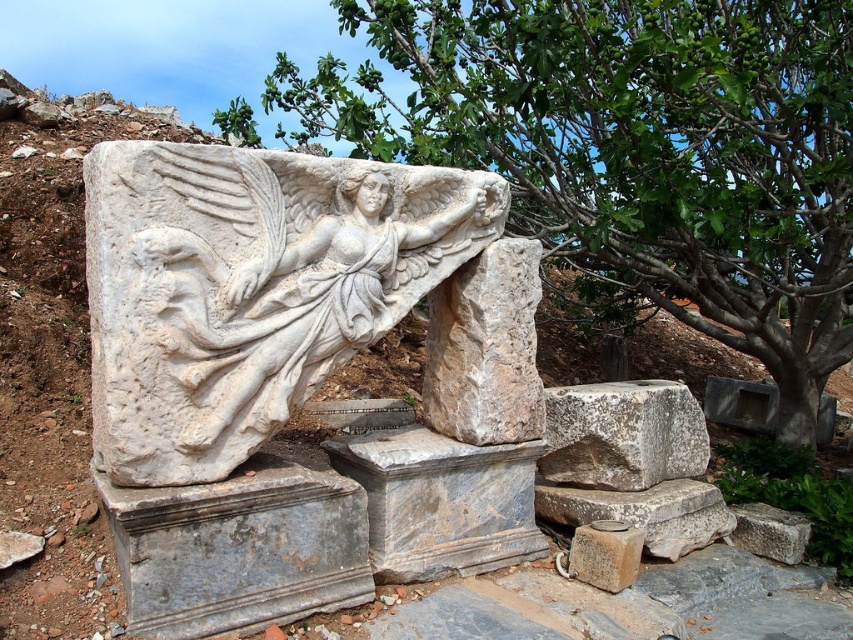
Question: Does white marble stone at center appear on the right side of smooth gray stone at lower center?

Choices:
 (A) no
 (B) yes

Answer: (A)

Question: Considering the real-world distances, which object is farthest from the gray rough stone at lower right?

Choices:
 (A) green leafy tree at upper center
 (B) white marble stone at center
 (C) gray rough stone at center

Answer: (A)

Question: Which of the following is the closest to the observer?

Choices:
 (A) gray rough stone at center
 (B) green leafy tree at upper center

Answer: (B)

Question: Does white marble sculpture at center have a lesser width compared to smooth gray stone at lower center?

Choices:
 (A) no
 (B) yes

Answer: (A)

Question: Observing the image, what is the correct spatial positioning of white marble stone at center in reference to gray rough stone at center?

Choices:
 (A) right
 (B) left

Answer: (B)

Question: Among these points, which one is farthest from the camera?

Choices:
 (A) (764, 531)
 (B) (567, 26)
 (C) (527, 314)
 (D) (590, 444)

Answer: (A)